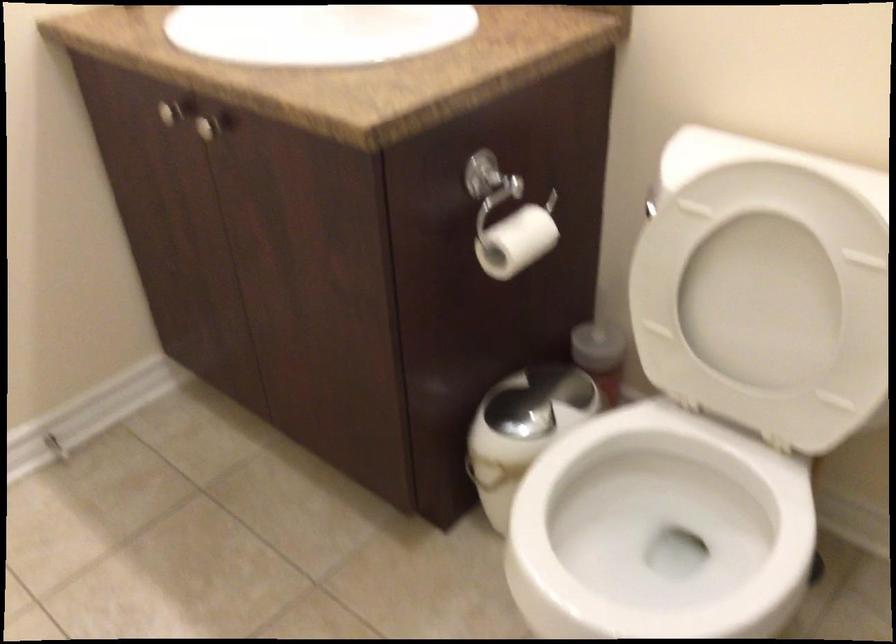
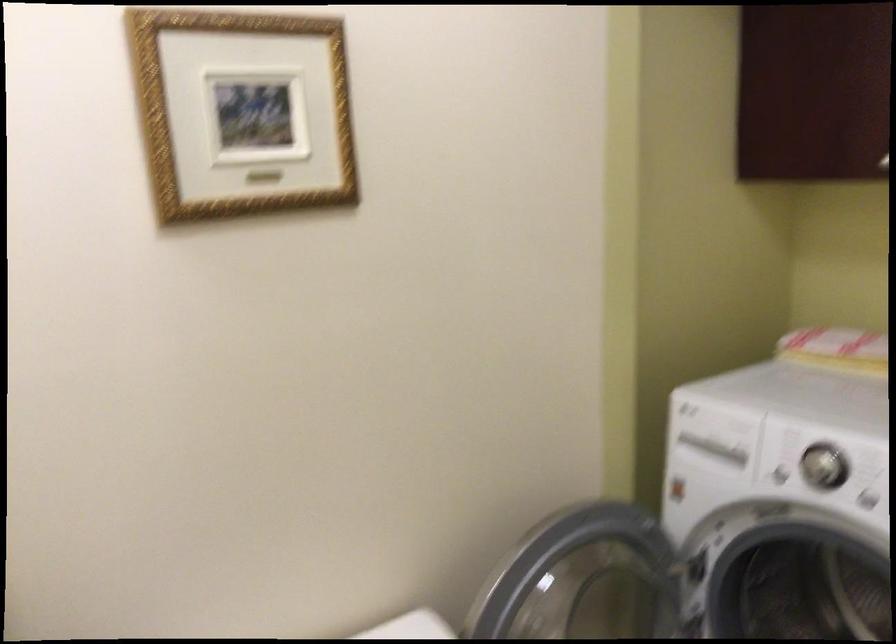
Question: How did the camera likely rotate?

Choices:
 (A) Left
 (B) Right
 (C) Up
 (D) Down

Answer: (B)